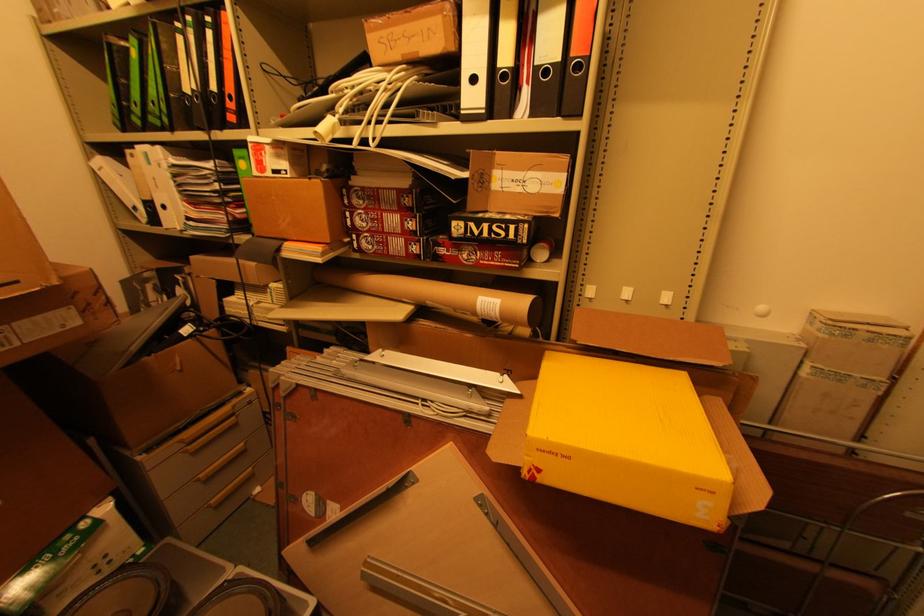
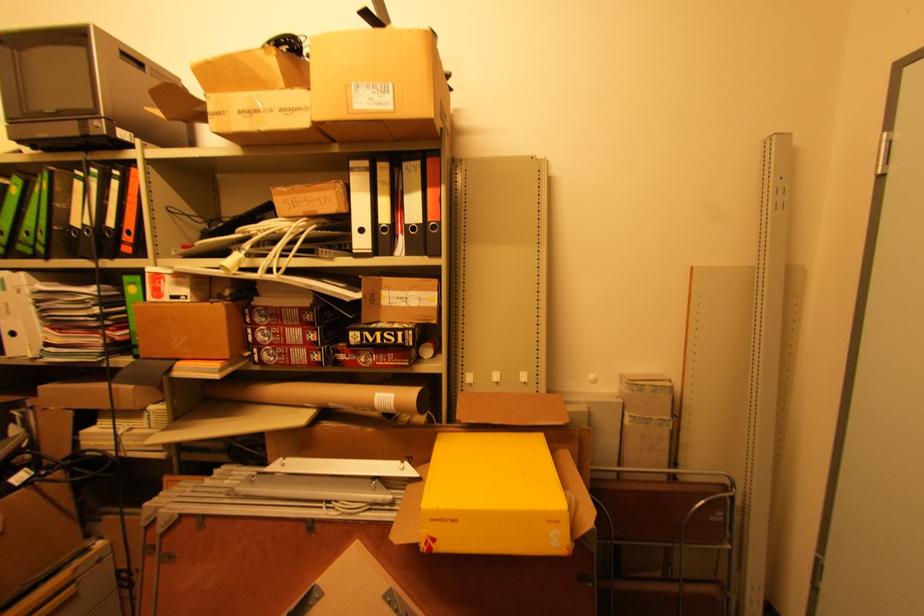
Where in the second image is the point corresponding to pixel 350 240 from the first image?

(251, 354)